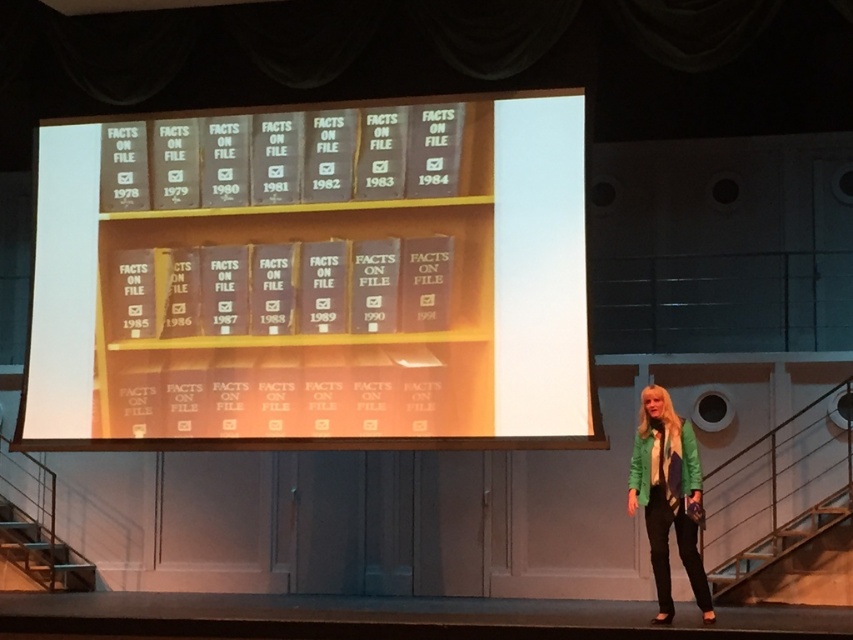
Does green leather jacket at lower right appear under green matte jacket at lower right?

Yes.

Does point (701, 508) lie in front of point (671, 474)?

Yes.

Locate an element on the screen. The height and width of the screenshot is (640, 853). green leather jacket at lower right is located at coordinates (668, 497).

Does matte gray bookshelf at center lie in front of green leather jacket at lower right?

No.

Is point (39, 205) less distant than point (674, 480)?

No, it is behind (674, 480).

Where is `matte gray bookshelf at center`? Image resolution: width=853 pixels, height=640 pixels. matte gray bookshelf at center is located at coordinates (312, 280).

Is matte gray bookshelf at center thinner than green matte jacket at lower right?

No, matte gray bookshelf at center is not thinner than green matte jacket at lower right.

Which is more to the right, matte gray bookshelf at center or green matte jacket at lower right?

Positioned to the right is green matte jacket at lower right.

This screenshot has width=853, height=640. Find the location of `matte gray bookshelf at center`. matte gray bookshelf at center is located at coordinates (312, 280).